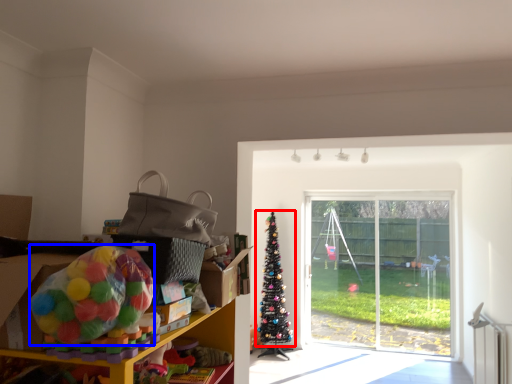
Question: Which object appears closest to the camera in this image, christmas tree (highlighted by a red box) or toy (highlighted by a blue box)?

Choices:
 (A) christmas tree
 (B) toy

Answer: (B)